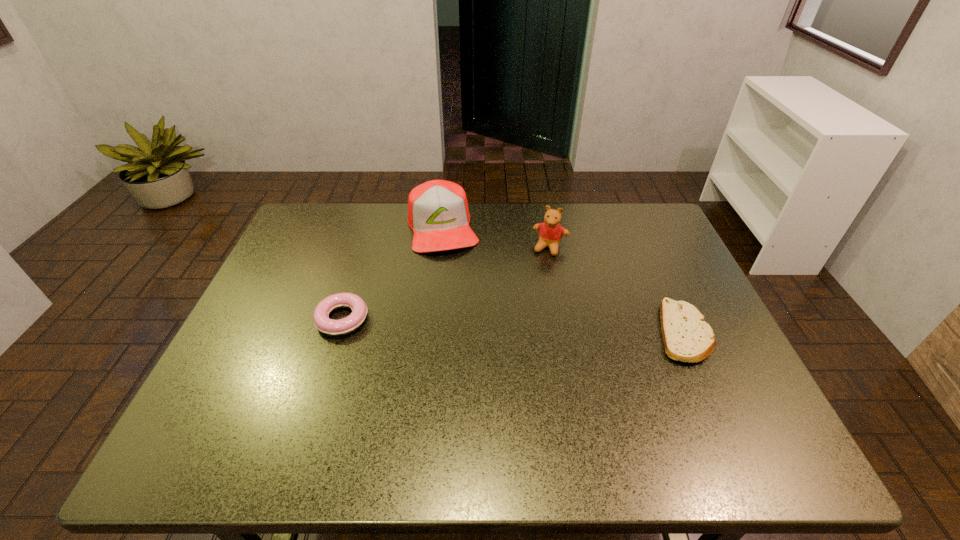
Where is `vacant area between the second object from right to left and the pita bread`? This screenshot has width=960, height=540. vacant area between the second object from right to left and the pita bread is located at coordinates (617, 290).

Identify the location of vacant area that lies between the third object from right to left and the doughnut. The image size is (960, 540). (393, 273).

Find the location of `empty location between the doughnut and the shortest object`. empty location between the doughnut and the shortest object is located at coordinates (513, 326).

The width and height of the screenshot is (960, 540). I want to click on object that can be found as the second closest to the second object from left to right, so click(322, 322).

Where is `object that ranks as the closest to the third object from left to right`? The image size is (960, 540). object that ranks as the closest to the third object from left to right is located at coordinates (438, 213).

Identify the location of free space that satisfies the following two spatial constraints: 1. on the front side of the third object from right to left; 2. on the right side of the teddy bear. (441, 248).

The width and height of the screenshot is (960, 540). Identify the location of vacant space that satisfies the following two spatial constraints: 1. on the front side of the shortest object; 2. on the left side of the leftmost object. (338, 333).